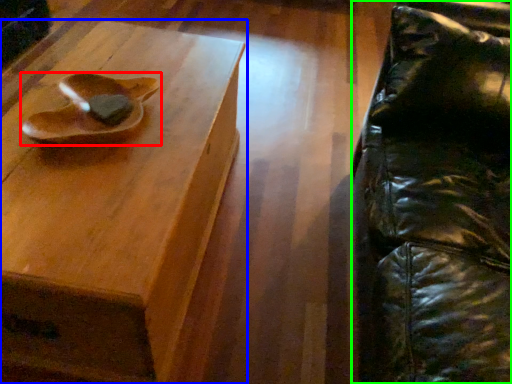
Question: Estimate the real-world distances between objects in this image. Which object is closer to footwear (highlighted by a red box), table (highlighted by a blue box) or swivel chair (highlighted by a green box)?

Choices:
 (A) table
 (B) swivel chair

Answer: (A)